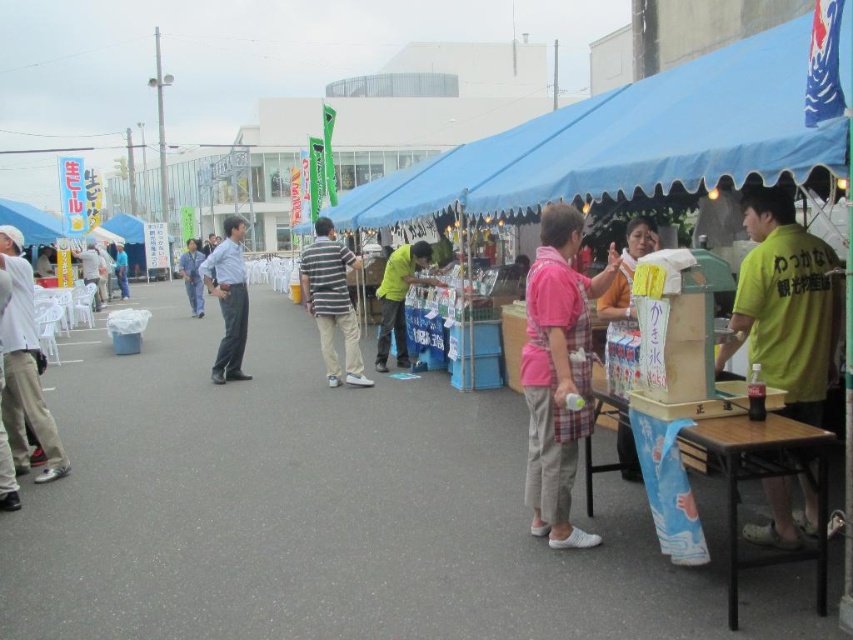
Question: Considering the real-world distances, which object is farthest from the pink fabric shirt at center?

Choices:
 (A) yellow-green shirt at center
 (B) blue fabric canopy at upper right

Answer: (A)

Question: Which object appears farthest from the camera in this image?

Choices:
 (A) blue denim jeans at center
 (B) blue fabric canopy at upper right
 (C) pink fabric shirt at center

Answer: (A)

Question: Is yellow-green shirt at center in front of blue denim jeans at center?

Choices:
 (A) no
 (B) yes

Answer: (B)

Question: Among these points, which one is farthest from the camera?

Choices:
 (A) (305, 282)
 (B) (549, 438)

Answer: (A)

Question: Is the position of pink fabric shirt at center more distant than that of yellow paper towel dispenser at center?

Choices:
 (A) yes
 (B) no

Answer: (B)

Question: Does striped cotton shirt at center appear over light blue jeans at center?

Choices:
 (A) no
 (B) yes

Answer: (B)